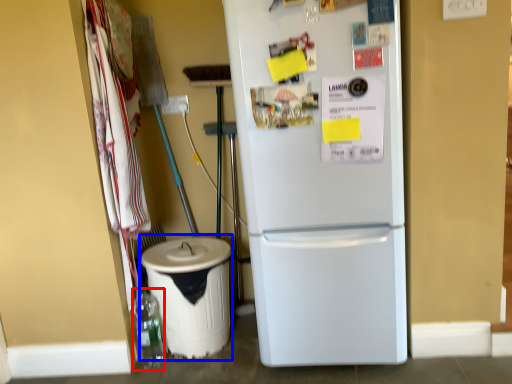
Question: Which of the following is the closest to the observer, bottle (highlighted by a red box) or recycling bin (highlighted by a blue box)?

Choices:
 (A) bottle
 (B) recycling bin

Answer: (B)